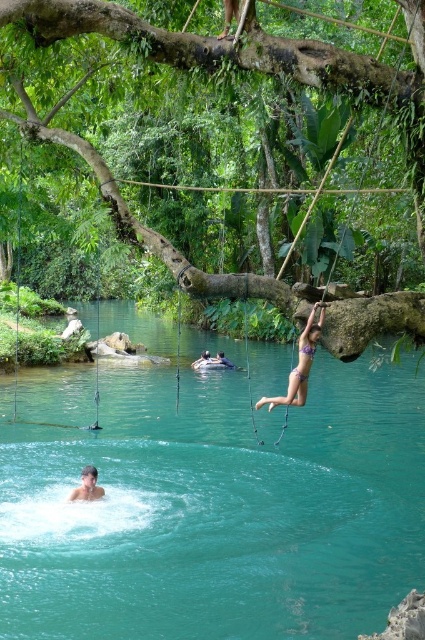
Question: Is purple bikini at center behind light blue fabric at center?

Choices:
 (A) no
 (B) yes

Answer: (A)

Question: Which point is closer to the camera taking this photo?

Choices:
 (A) (331, 508)
 (B) (201, 356)

Answer: (A)

Question: Which object is the closest to the purple bikini at center?

Choices:
 (A) light blue fabric at center
 (B) teal glossy water at center

Answer: (B)

Question: Which point is farther to the camera?

Choices:
 (A) purple bikini at center
 (B) light blue fabric at center
 (C) teal glossy water at center
 (D) smooth skin face at lower left

Answer: (B)

Question: Is purple bikini at center positioned in front of light blue fabric at center?

Choices:
 (A) no
 (B) yes

Answer: (B)

Question: Can you confirm if purple bikini at center is positioned to the right of light blue fabric at center?

Choices:
 (A) yes
 (B) no

Answer: (A)